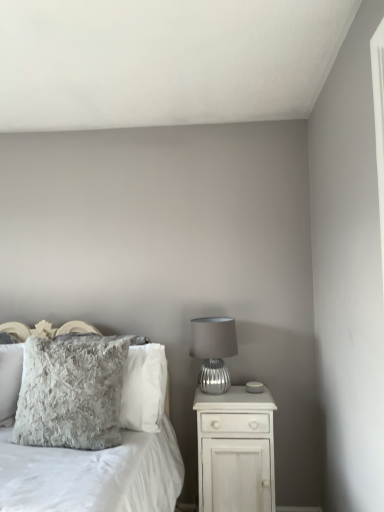
Locate an element on the screen. vacant area on top of white wood nightstand at right (from a real-world perspective) is located at coordinates (238, 392).